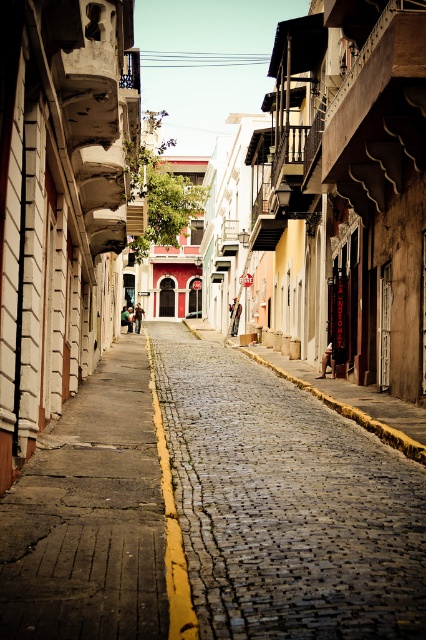
You are standing on the cobblestone street and want to walk from the point at coordinates (259, 442) to the point at coordinates (97, 609). Which direction should you move to get closer to your destination?

You should move towards the lower right direction because point (97, 609) is closer to the viewer than point (259, 442), so moving in that direction will bring you closer to the destination.

You are standing on the cobblestone pavement at center marked by point (285, 504). You want to walk to the nearest building on the left side of the street. Is the distance from your current position to the nearest building on the left side of the street less than 10 meters?

The point (285, 504) marks cobblestone pavement at center. The nearest building on the left side of the street is within 10 meters from this point.